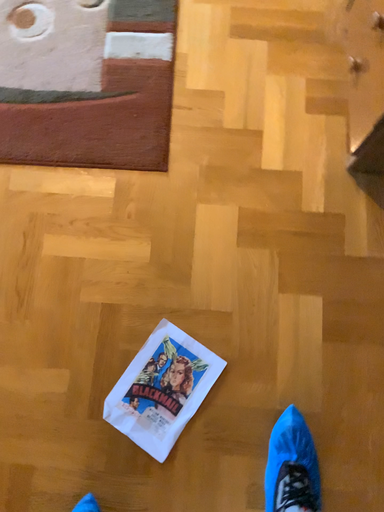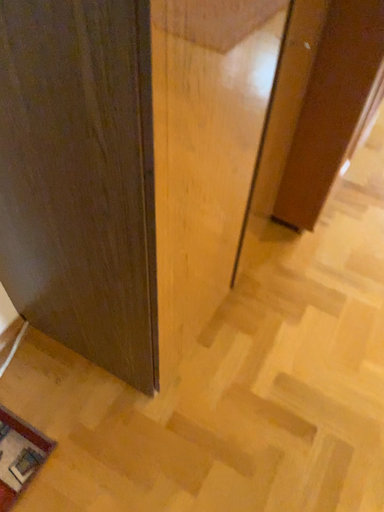
Question: Which way did the camera rotate in the video?

Choices:
 (A) rotated left
 (B) rotated right

Answer: (A)